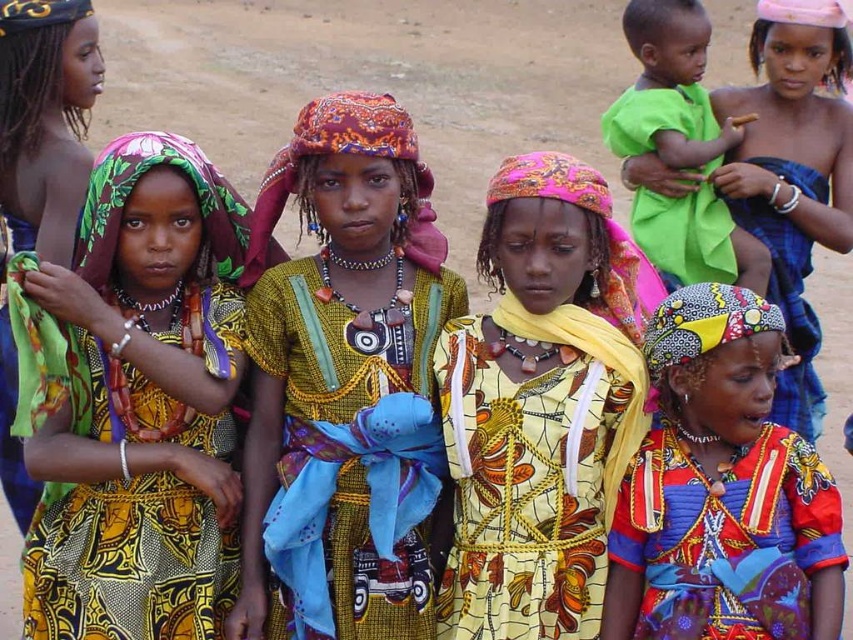
Question: Based on their relative distances, which object is nearer to the matte yellow dress at center?

Choices:
 (A) printed fabric dress at left
 (B) multicolored fabric dress at center
 (C) vibrant printed dress at center

Answer: (C)

Question: Does printed fabric dress at left have a lesser width compared to yellow printed dress at center?

Choices:
 (A) no
 (B) yes

Answer: (B)

Question: Can you confirm if printed fabric dress at left is positioned above printed fabric dress at center?

Choices:
 (A) no
 (B) yes

Answer: (A)

Question: Which of these objects is positioned farthest from the green fabric shirt at upper right?

Choices:
 (A) multicolored fabric dress at center
 (B) yellow printed dress at center

Answer: (B)

Question: Which point is farther to the camera?

Choices:
 (A) matte yellow dress at center
 (B) printed fabric dress at left

Answer: (B)

Question: Does matte yellow dress at center have a larger size compared to yellow printed dress at center?

Choices:
 (A) yes
 (B) no

Answer: (A)